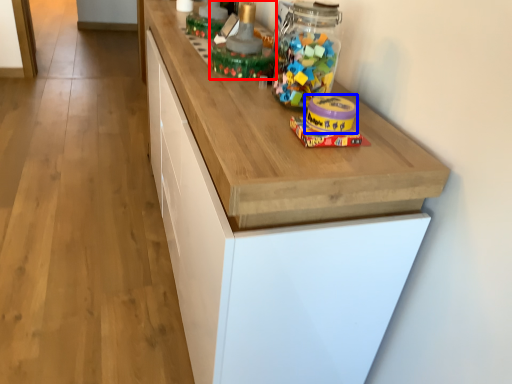
Question: Which object appears farthest to the camera in this image, toy (highlighted by a red box) or toy (highlighted by a blue box)?

Choices:
 (A) toy
 (B) toy

Answer: (A)